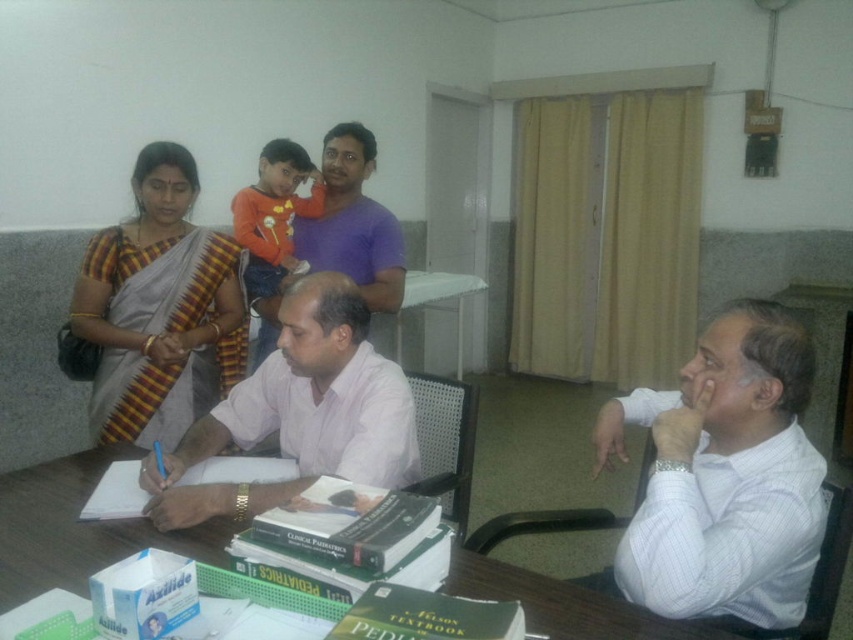
Question: Estimate the real-world distances between objects in this image. Which object is closer to the white striped shirt at lower right?

Choices:
 (A) wooden table at center
 (B) purple cotton shirt at upper center

Answer: (A)

Question: Is white striped shirt at lower right to the right of pink shirt at center from the viewer's perspective?

Choices:
 (A) yes
 (B) no

Answer: (A)

Question: Can you confirm if yellow striped saree at upper left is wider than wooden table at center?

Choices:
 (A) yes
 (B) no

Answer: (B)

Question: In this image, where is yellow striped saree at upper left located relative to purple cotton shirt at upper center?

Choices:
 (A) below
 (B) above

Answer: (A)

Question: Among these points, which one is nearest to the camera?

Choices:
 (A) (350, 163)
 (B) (287, 444)

Answer: (B)

Question: Which point appears farthest from the camera in this image?

Choices:
 (A) (677, 627)
 (B) (341, 214)
 (C) (74, 320)

Answer: (B)